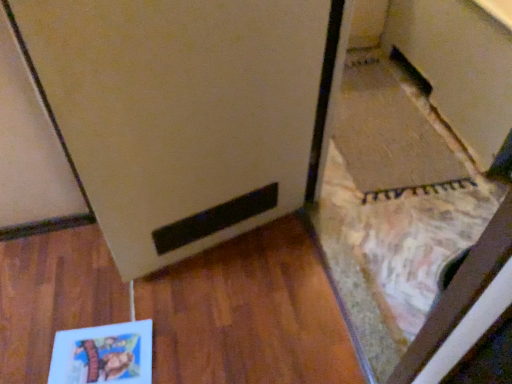
Locate an element on the screen. Image resolution: width=512 pixels, height=384 pixels. vacant region under matte white fridge at center (from a real-world perspective) is located at coordinates (229, 240).